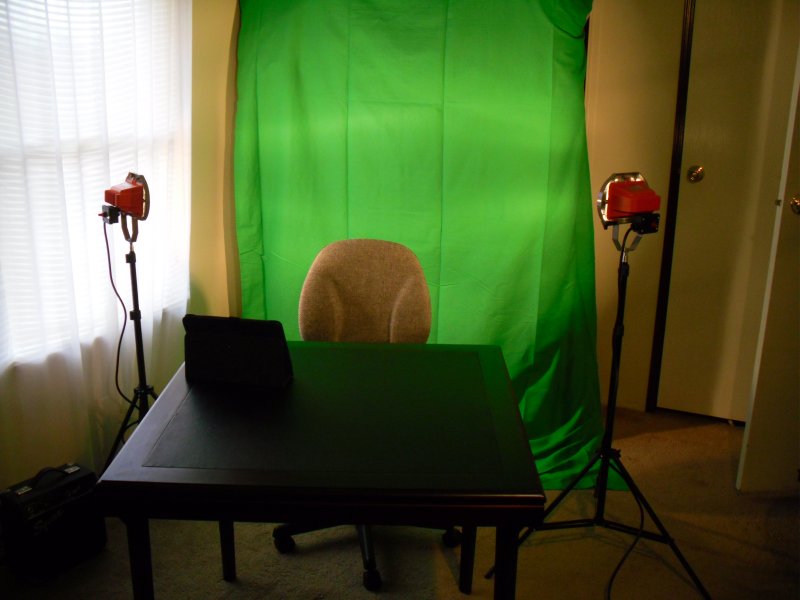
This screenshot has width=800, height=600. In order to click on table in this screenshot , I will do `click(358, 412)`.